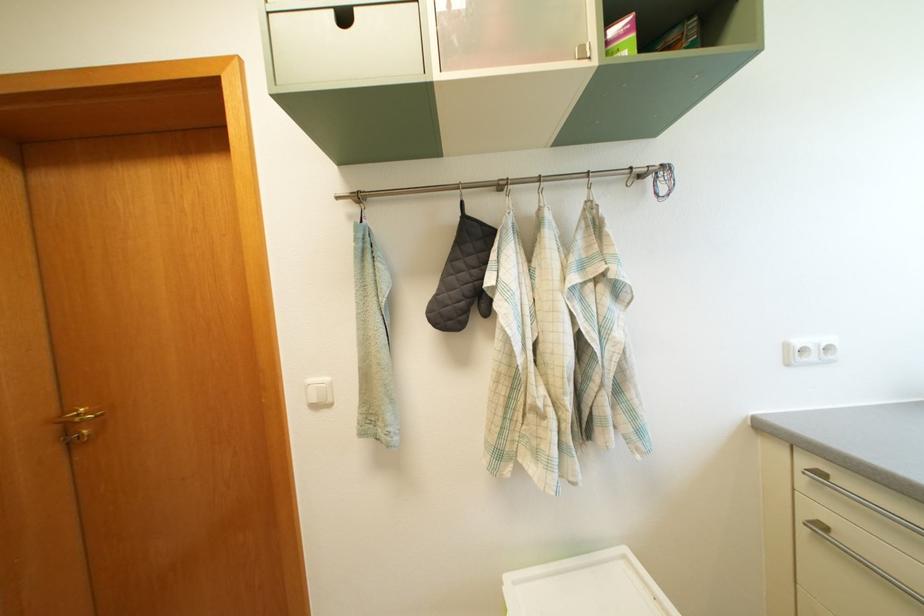
This screenshot has height=616, width=924. In order to click on white bin lid in this screenshot , I will do `click(586, 593)`.